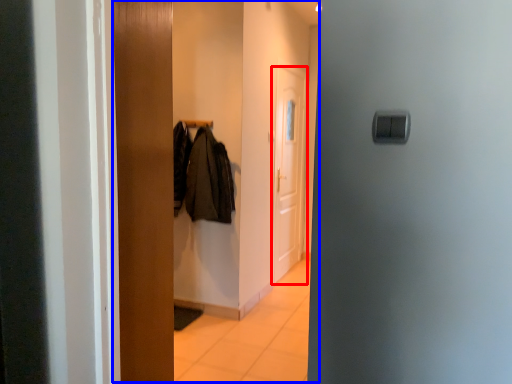
Question: Which of the following is the farthest to the observer, door (highlighted by a red box) or dresser (highlighted by a blue box)?

Choices:
 (A) door
 (B) dresser

Answer: (A)